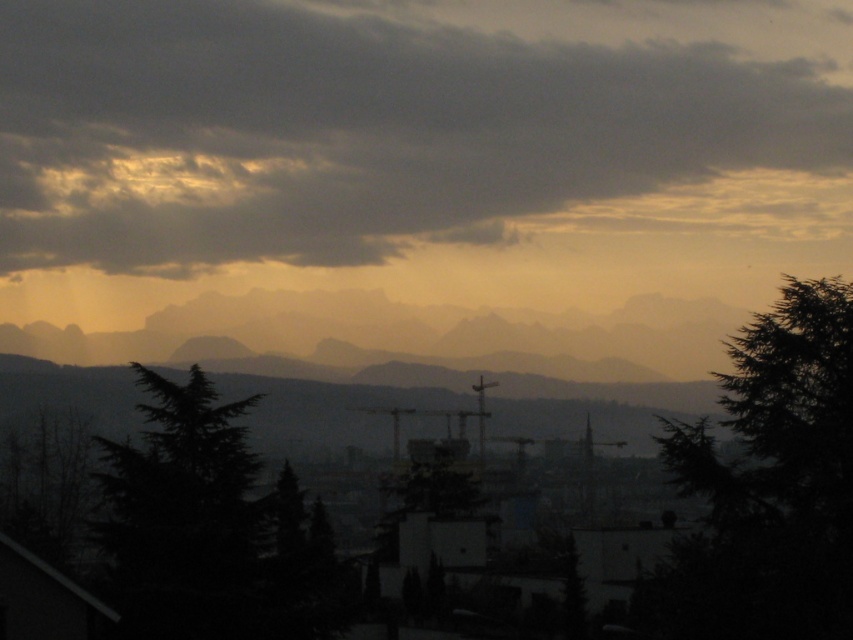
You are a drone operator planning to fly a drone between the dark gray textured cloud at upper center and the green textured tree at right. The drone has a maximum flight range of 300 meters. Can the drone safely travel between these two points without running out of battery?

The distance between the dark gray textured cloud at upper center and the green textured tree at right is 324.53 meters, which exceeds the drone maximum flight range of 300 meters. Therefore, the drone cannot safely travel between these two points without running out of battery.

You are standing at the point closest to you in the image. Which point are you at, point (693, 216) or point (740, 618)?

You are at point (693, 216) because it is closer to the viewer than point (740, 618).

From the picture: You are an astronomer analyzing the image. You need to locate the dark gray textured cloud at upper center. What are its coordinates in the image?

The dark gray textured cloud at upper center is located at coordinates (403, 125).